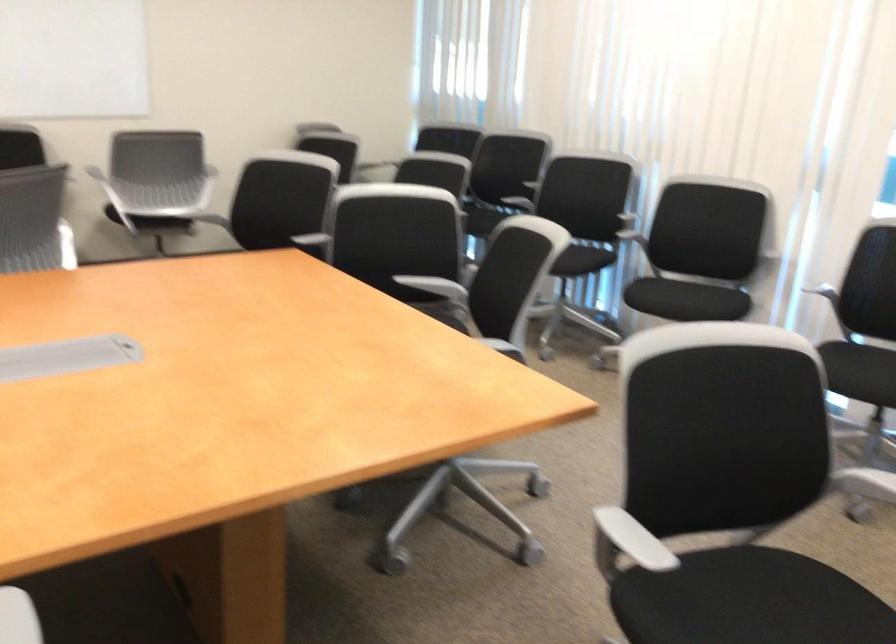
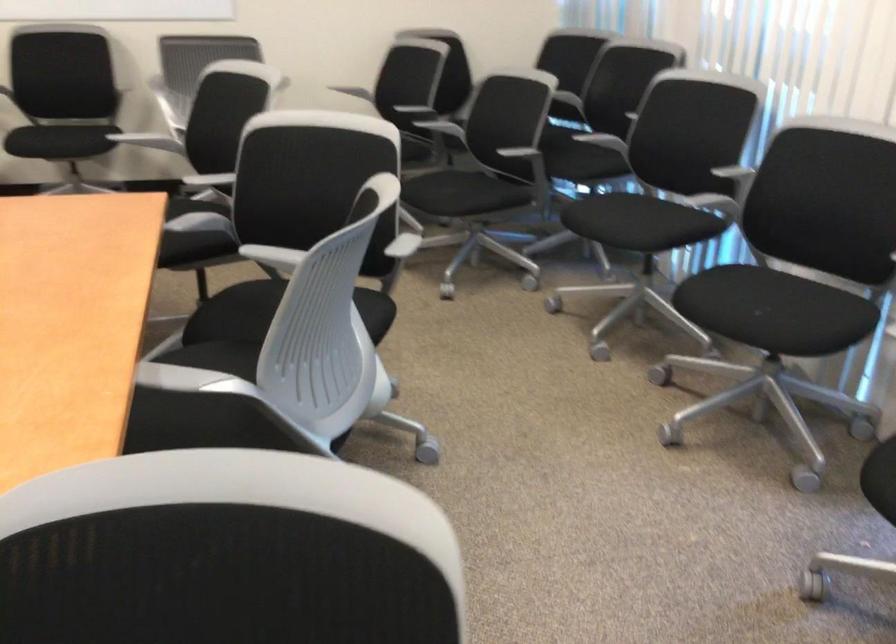
The point at (418, 283) is marked in the first image. Where is the corresponding point in the second image?

(273, 258)